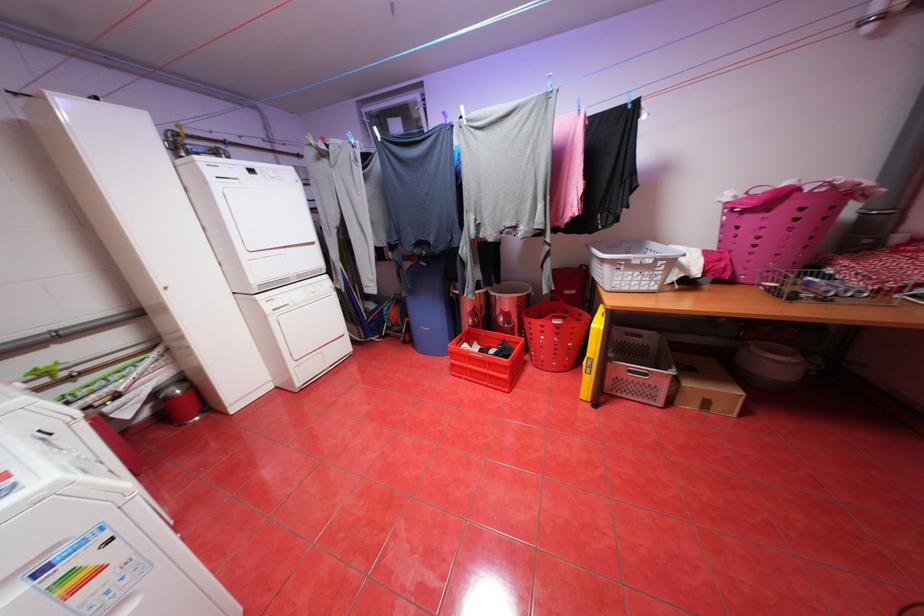
The height and width of the screenshot is (616, 924). What do you see at coordinates (628, 346) in the screenshot? I see `a grey crate handle` at bounding box center [628, 346].